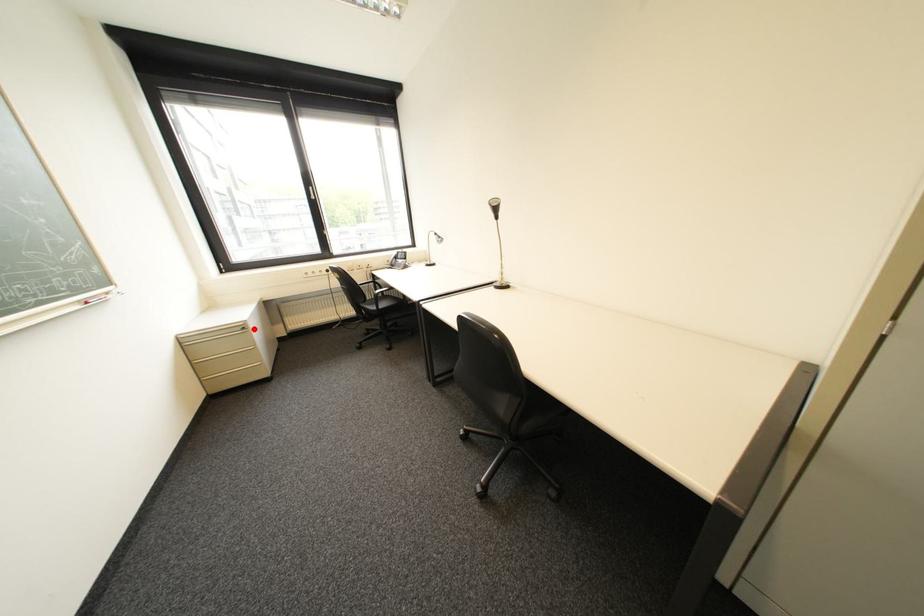
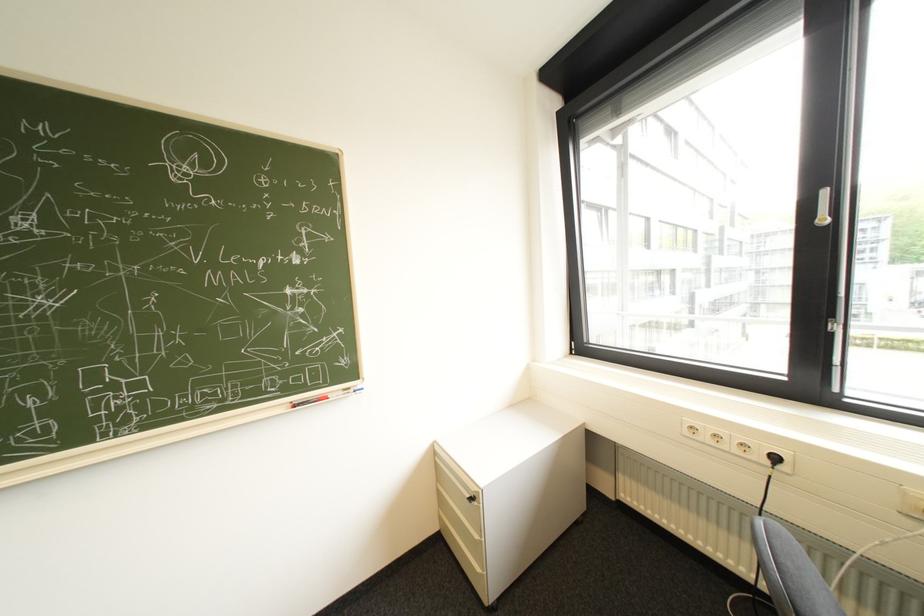
Question: I am providing you with two images of the same scene from different viewpoints. A red point is marked on the first image. Is the red point's position out of view in image 2?

Choices:
 (A) Yes
 (B) No

Answer: (B)